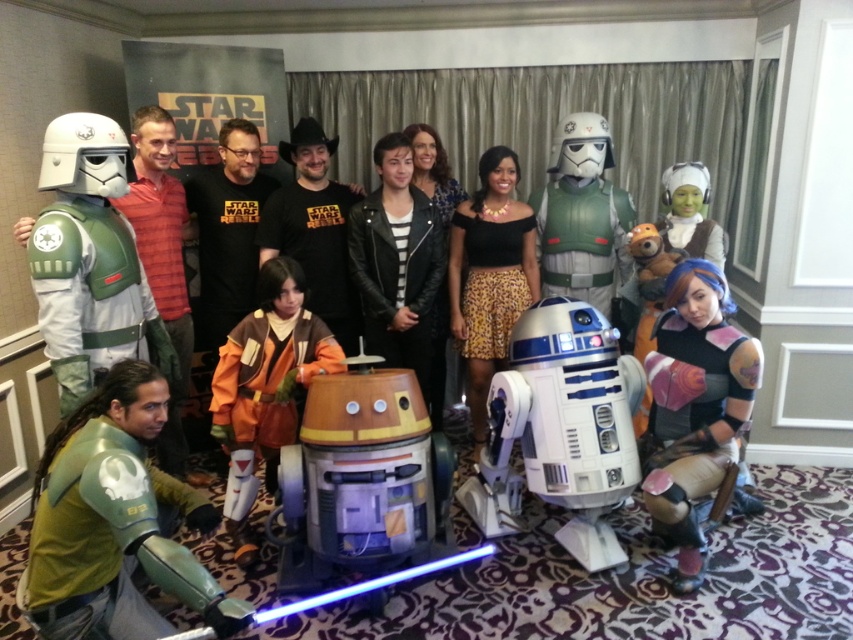
Looking at this image, what is located at the coordinate point (x=91, y=296) in the image?

The green fabric costume at left is located at the coordinate point (x=91, y=296).